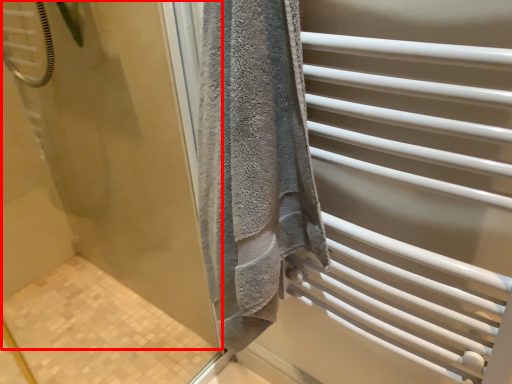
Question: From the image's perspective, what is the correct spatial relationship of screen door (annotated by the red box) in relation to screen door?

Choices:
 (A) above
 (B) below

Answer: (B)